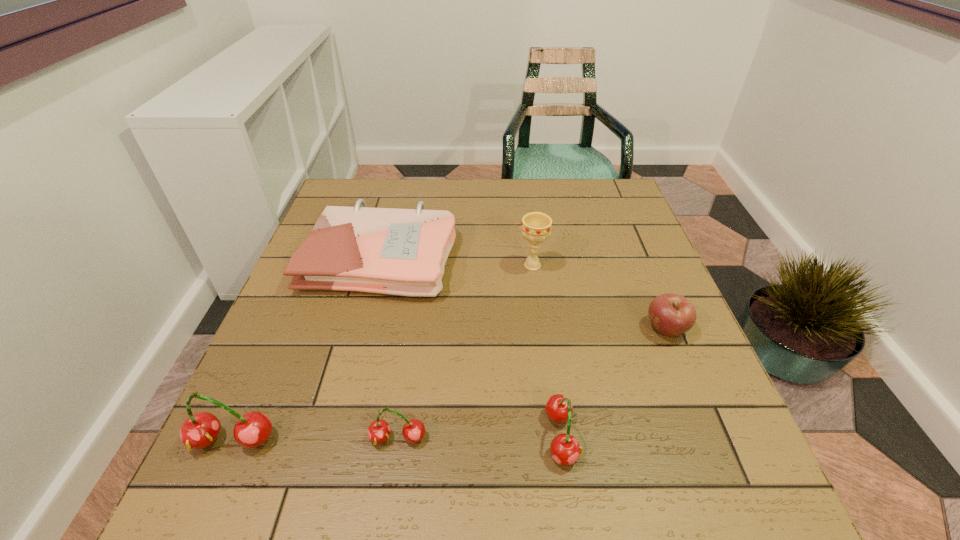
Image resolution: width=960 pixels, height=540 pixels. Identify the location of the tallest cherry. (200, 430).

Where is `the second cherry from left to right`? This screenshot has width=960, height=540. the second cherry from left to right is located at coordinates (379, 431).

The height and width of the screenshot is (540, 960). What are the coordinates of `the third tallest object` in the screenshot? It's located at (564, 448).

This screenshot has width=960, height=540. Find the location of `the second shortest cherry`. the second shortest cherry is located at coordinates (564, 448).

Find the location of a particular element. The image size is (960, 540). chalice is located at coordinates (536, 226).

Where is `apple`? apple is located at coordinates (671, 315).

I want to click on the rightmost object, so click(x=671, y=315).

This screenshot has height=540, width=960. I want to click on phonebook, so click(x=403, y=252).

Locate an element on the screen. Image resolution: width=960 pixels, height=540 pixels. vacant area situated with stems pointing upwards on the second shortest cherry is located at coordinates (x=690, y=436).

Image resolution: width=960 pixels, height=540 pixels. Identify the location of blank area located on the left of the chalice. (372, 266).